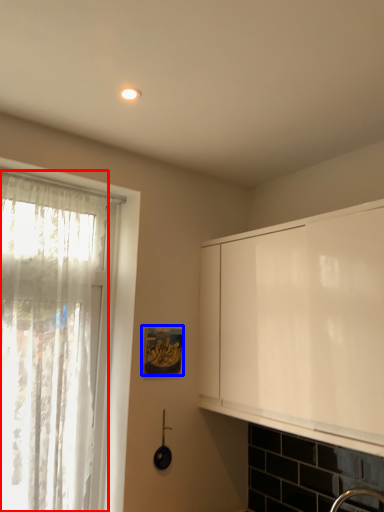
Question: Which object appears farthest to the camera in this image, curtain (highlighted by a red box) or picture frame (highlighted by a blue box)?

Choices:
 (A) curtain
 (B) picture frame

Answer: (B)